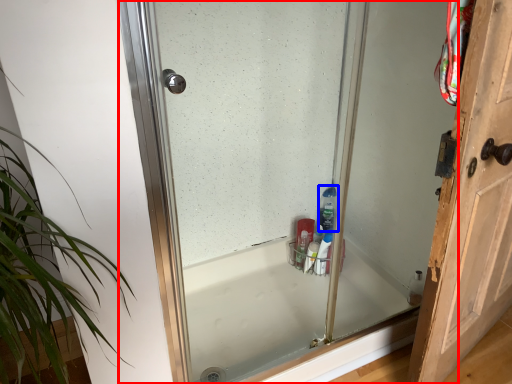
Question: Which object is further to the camera taking this photo, glass door (highlighted by a red box) or cleaning product (highlighted by a blue box)?

Choices:
 (A) glass door
 (B) cleaning product

Answer: (B)